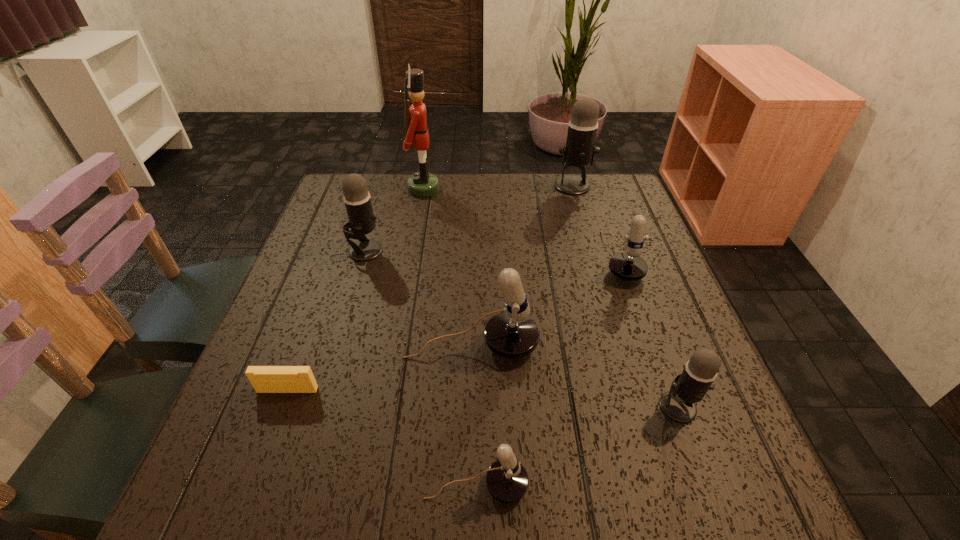
This screenshot has width=960, height=540. I want to click on nutcracker, so click(x=421, y=184).

Where is `the tallest object`? The image size is (960, 540). the tallest object is located at coordinates (421, 184).

This screenshot has width=960, height=540. I want to click on the farthest microphone, so click(579, 151).

Locate an element on the screen. This screenshot has height=540, width=960. the seventh shortest object is located at coordinates (579, 151).

The image size is (960, 540). In order to click on the second farthest gray microphone in this screenshot , I will do `click(357, 200)`.

I want to click on the second biggest gray microphone, so click(x=357, y=200).

You are a GUI agent. You are given a task and a screenshot of the screen. Output one action in this format:
    pyautogui.click(x=<x>, y=<y>)
    Task: Click on the fourth nearest object
    This screenshot has width=960, height=540.
    Given the screenshot: What is the action you would take?
    pyautogui.click(x=512, y=334)

This screenshot has width=960, height=540. I want to click on the biggest white microphone, so click(x=512, y=334).

In order to click on the second smallest white microphone in this screenshot , I will do click(629, 266).

I want to click on the rightmost white microphone, so click(x=629, y=266).